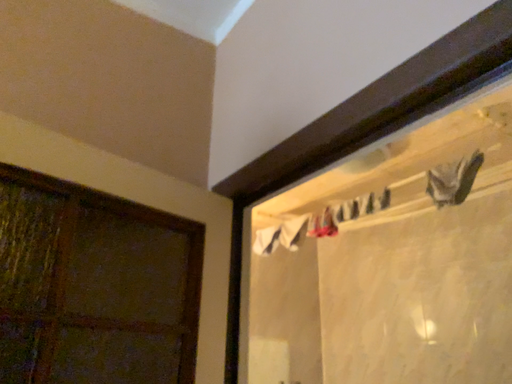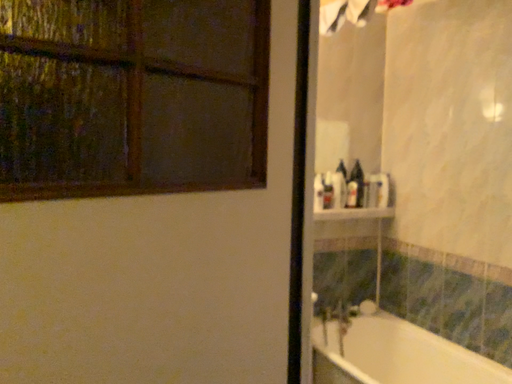
Question: Which way did the camera rotate in the video?

Choices:
 (A) rotated upward
 (B) rotated downward

Answer: (B)